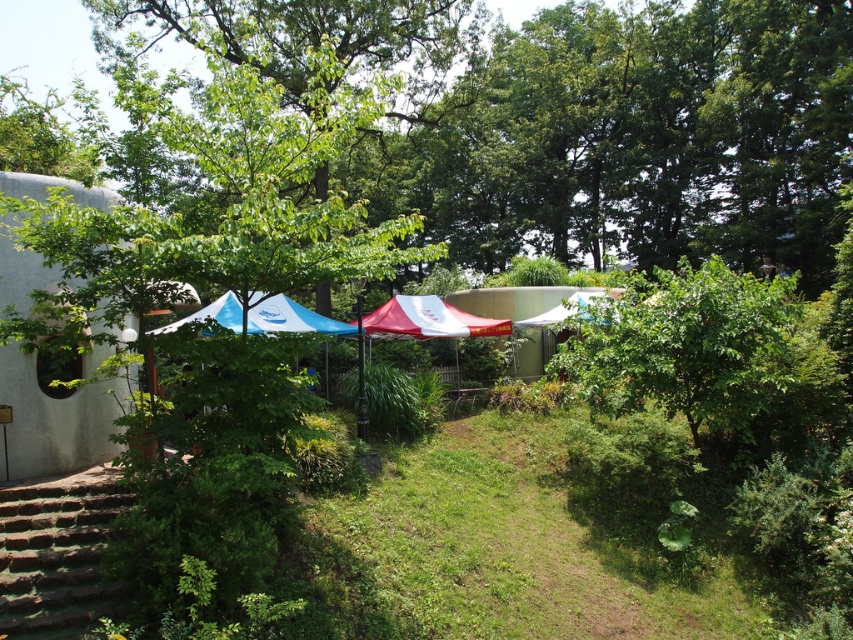
Between green grass at center and red fabric canopy at center, which one is positioned higher?

Positioned higher is red fabric canopy at center.

Is green grass at center to the left of red fabric canopy at center from the viewer's perspective?

No, green grass at center is not to the left of red fabric canopy at center.

In order to click on green grass at center in this screenshot , I will do `click(502, 550)`.

Does green grass at center have a lesser width compared to blue fabric canopy at center?

Indeed, green grass at center has a lesser width compared to blue fabric canopy at center.

How distant is green grass at center from blue fabric canopy at center?

green grass at center and blue fabric canopy at center are 29.04 feet apart from each other.

Find the location of a particular element. green grass at center is located at coordinates (502, 550).

At what (x,y) coordinates should I click in order to perform the action: click on green grass at center. Please return your answer as a coordinate pair (x, y). This screenshot has width=853, height=640. Looking at the image, I should click on (502, 550).

Does red fabric canopy at center have a lesser width compared to white fabric canopy at center?

Yes.

Which of these two, red fabric canopy at center or white fabric canopy at center, stands taller?

Standing taller between the two is white fabric canopy at center.

Is point (369, 316) positioned behind point (550, 308)?

No, (369, 316) is in front of (550, 308).

Image resolution: width=853 pixels, height=640 pixels. Identify the location of red fabric canopy at center. (428, 320).